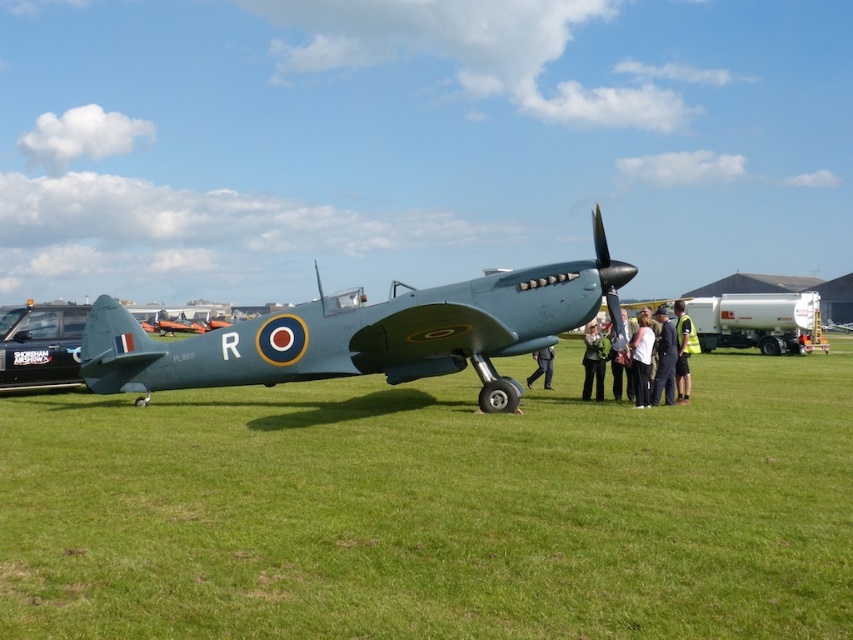
You are a photographer standing in front of the Supermarine Spitfire. You notice two items at the center of the image. Which one is smaller in size between the green grass at center and the white fabric jacket at center?

The green grass at center is smaller in size compared to the white fabric jacket at center according to the description.

You are a photographer standing in front of the Supermarine Spitfire. You notice the green grass at center and the white fabric jacket at center. Which object is wider?

The green grass at center is wider than the white fabric jacket at center.